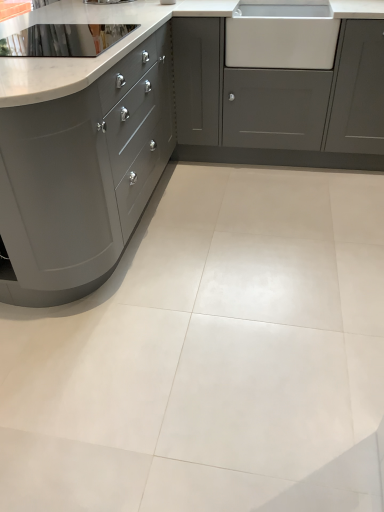
Question: Is white glossy tile at center at the left side of white glossy sink at upper right?

Choices:
 (A) no
 (B) yes

Answer: (B)

Question: Does white glossy tile at center appear on the right side of white glossy sink at upper right?

Choices:
 (A) yes
 (B) no

Answer: (B)

Question: Is white glossy sink at upper right surrounded by white glossy tile at center?

Choices:
 (A) yes
 (B) no

Answer: (B)

Question: Is white glossy tile at center smaller than white glossy sink at upper right?

Choices:
 (A) yes
 (B) no

Answer: (B)

Question: From a real-world perspective, is white glossy tile at center on white glossy sink at upper right?

Choices:
 (A) yes
 (B) no

Answer: (B)

Question: Are white glossy tile at center and white glossy sink at upper right located far from each other?

Choices:
 (A) no
 (B) yes

Answer: (B)

Question: Can you confirm if matte gray cabinetry at left, which is counted as the 2th cabinetry, starting from the right, is bigger than matte gray cabinet at center, marked as the second cabinetry in a left-to-right arrangement?

Choices:
 (A) yes
 (B) no

Answer: (A)

Question: Is matte gray cabinet at center, the first cabinetry positioned from the right, at the back of matte gray cabinetry at left, marked as the first cabinetry in a left-to-right arrangement?

Choices:
 (A) no
 (B) yes

Answer: (A)

Question: Does matte gray cabinetry at left, which is counted as the 2th cabinetry, starting from the right, have a greater width compared to matte gray cabinet at center, marked as the second cabinetry in a left-to-right arrangement?

Choices:
 (A) no
 (B) yes

Answer: (B)

Question: Is matte gray cabinetry at left, which is counted as the 2th cabinetry, starting from the right, smaller than matte gray cabinet at center, the first cabinetry positioned from the right?

Choices:
 (A) no
 (B) yes

Answer: (A)

Question: Is matte gray cabinet at center, the first cabinetry positioned from the right, surrounded by matte gray cabinetry at left, which is counted as the 2th cabinetry, starting from the right?

Choices:
 (A) yes
 (B) no

Answer: (B)

Question: Is matte gray cabinetry at left, which is counted as the 2th cabinetry, starting from the right, far from matte gray cabinet at center, the first cabinetry positioned from the right?

Choices:
 (A) no
 (B) yes

Answer: (A)

Question: From the image's perspective, would you say matte gray cabinet at center, marked as the second cabinetry in a left-to-right arrangement, is positioned over matte gray cabinetry at left, marked as the first cabinetry in a left-to-right arrangement?

Choices:
 (A) yes
 (B) no

Answer: (A)